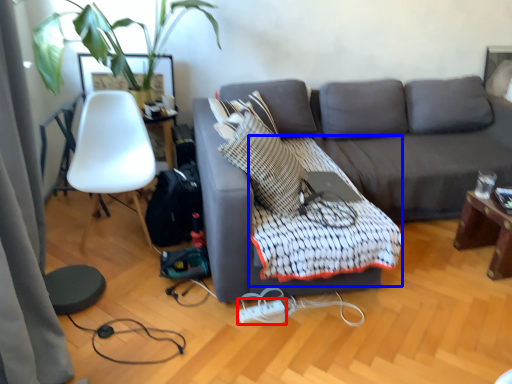
Question: Which of the following is the closest to the observer, extension cord (highlighted by a red box) or quilt (highlighted by a blue box)?

Choices:
 (A) extension cord
 (B) quilt

Answer: (B)